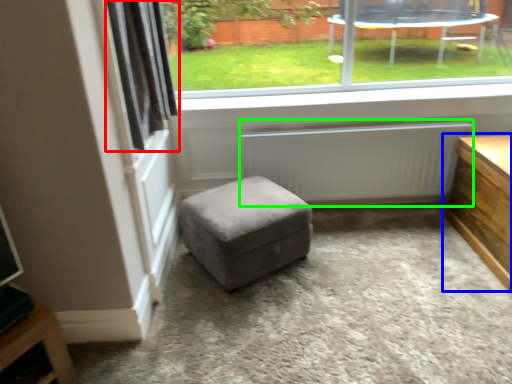
Question: Based on their relative distances, which object is farther from curtain (highlighted by a red box)? Choose from table (highlighted by a blue box) and radiator (highlighted by a green box).

Choices:
 (A) table
 (B) radiator

Answer: (A)